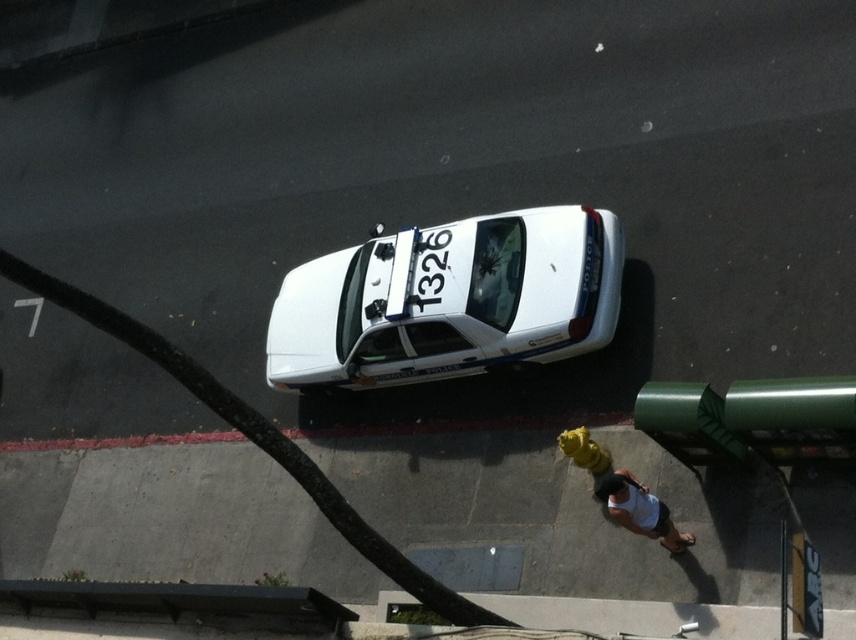
Question: Is white glossy police car at center positioned in front of shiny black car at center?

Choices:
 (A) no
 (B) yes

Answer: (B)

Question: Does shiny black car at center come behind white tank top at center?

Choices:
 (A) no
 (B) yes

Answer: (B)

Question: Which object is positioned closest to the white tank top at center?

Choices:
 (A) white glossy police car at center
 (B) shiny black car at center

Answer: (B)

Question: Which is farther from the shiny black car at center?

Choices:
 (A) white tank top at center
 (B) white glossy police car at center

Answer: (A)

Question: Where is shiny black car at center located in relation to white tank top at center in the image?

Choices:
 (A) above
 (B) below

Answer: (A)

Question: Which point appears closest to the camera in this image?

Choices:
 (A) (611, 513)
 (B) (470, 288)

Answer: (A)